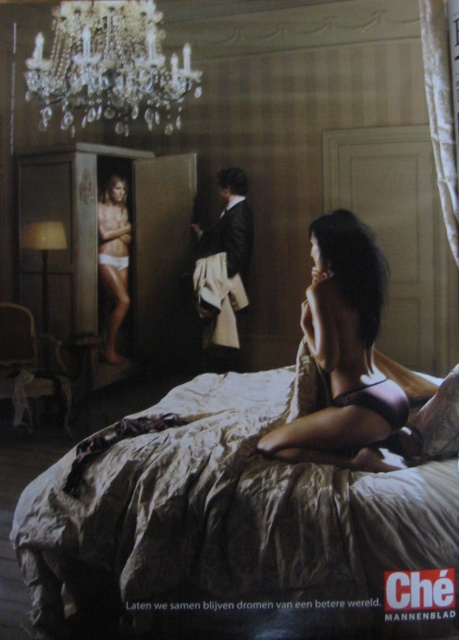
Is point (381, 289) positioned before point (241, 234)?

Yes, point (381, 289) is closer to viewer.

Does point (358, 244) come farther from viewer compared to point (220, 308)?

No, it is in front of (220, 308).

Locate an element on the screen. satin black lingerie at center is located at coordinates (343, 353).

Which of these two, silky white sheets at center or leather jacket at center, stands shorter?

silky white sheets at center is shorter.

Which of these two, silky white sheets at center or leather jacket at center, stands taller?

leather jacket at center is taller.

Does point (107, 545) lie behind point (207, 228)?

No, (107, 545) is in front of (207, 228).

This screenshot has width=459, height=640. I want to click on silky white sheets at center, so click(240, 522).

Is point (31, 96) behind point (116, 321)?

No.

Does point (91, 118) lie in front of point (116, 225)?

Yes, point (91, 118) is in front of point (116, 225).

Is point (151, 118) in front of point (127, 308)?

Yes, it is in front of point (127, 308).

Image resolution: width=459 pixels, height=640 pixels. In order to click on crystal glass chandelier at upper center in this screenshot , I will do `click(110, 67)`.